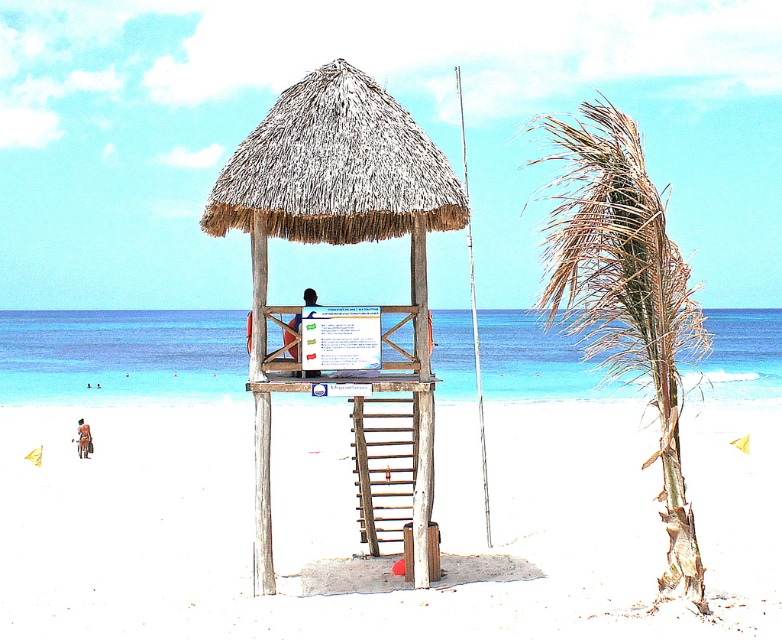
Question: Considering the real-world distances, which object is closest to the wooden at center?

Choices:
 (A) brown leather bag at center
 (B) smooth wooden pole at center
 (C) wooden pole at center
 (D) blue fabric shirt at center

Answer: (D)

Question: Which object is the closest to the smooth wooden pole at center?

Choices:
 (A) wooden at center
 (B) thatched wood hut at center
 (C) white sandy beach at center
 (D) blue fabric shirt at center

Answer: (C)

Question: Can you confirm if white sandy beach at center is positioned above thatched wood hut at center?

Choices:
 (A) no
 (B) yes

Answer: (A)

Question: Is wooden at center to the left of wooden pole at center from the viewer's perspective?

Choices:
 (A) no
 (B) yes

Answer: (A)

Question: Can you confirm if wooden pole at center is positioned to the right of brown leather bag at center?

Choices:
 (A) no
 (B) yes

Answer: (B)

Question: Which point is farther from the camera taking this photo?

Choices:
 (A) (427, 166)
 (B) (472, 292)
 (C) (397, 422)

Answer: (B)